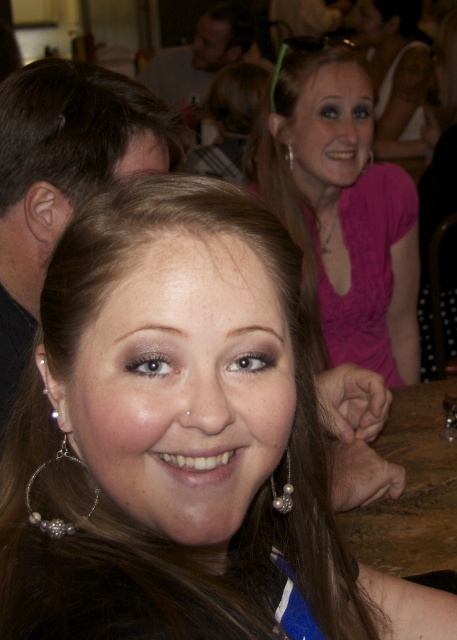
Question: Which point is farther to the camera?

Choices:
 (A) (407, 140)
 (B) (290, 509)
 (C) (378, 170)

Answer: (A)

Question: Does brownsmoothhair at center appear on the right side of pink satin blouse at upper center?

Choices:
 (A) no
 (B) yes

Answer: (A)

Question: Which of the following is the farthest from the observer?

Choices:
 (A) (281, 509)
 (B) (36, 564)

Answer: (A)

Question: Which object is closer to the camera taking this photo?

Choices:
 (A) shiny silver hoop earrings at center
 (B) brownsmoothhair at center
 (C) matte pink blouse at upper center
 (D) dark brown hair at upper left

Answer: (B)

Question: Where is dark brown hair at upper left located in relation to matte pink blouse at upper center in the image?

Choices:
 (A) left
 (B) right

Answer: (A)

Question: Does brownsmoothhair at center have a smaller size compared to pink satin blouse at upper center?

Choices:
 (A) no
 (B) yes

Answer: (B)